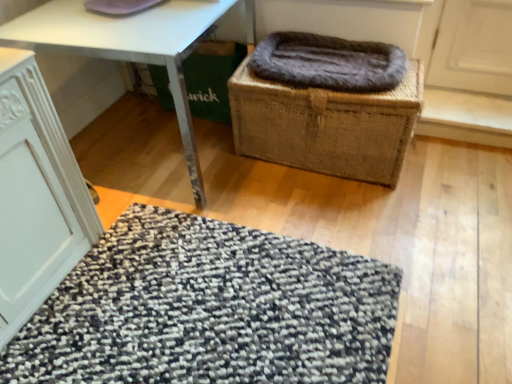
Locate an element on the screen. vacant space that is in between white glossy table at center and woven brown basket at center is located at coordinates (288, 190).